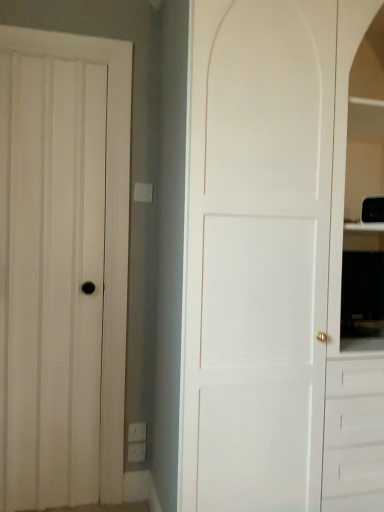
Locate an element on the screen. white matte door at left, the 2th door from the right is located at coordinates (105, 228).

The image size is (384, 512). Describe the element at coordinates (105, 228) in the screenshot. I see `white matte door at left, arranged as the first door when viewed from the left` at that location.

This screenshot has width=384, height=512. I want to click on white matte door at right, the first door positioned from the right, so click(257, 253).

The width and height of the screenshot is (384, 512). Describe the element at coordinates (257, 253) in the screenshot. I see `white matte door at right, the second door when ordered from left to right` at that location.

This screenshot has width=384, height=512. In order to click on white matte door at left, arranged as the first door when viewed from the left in this screenshot , I will do `click(105, 228)`.

Can you confirm if white matte door at left, the 2th door from the right, is positioned to the left of white matte door at right, the first door positioned from the right?

Yes.

Which object is more forward, white matte door at left, arranged as the first door when viewed from the left, or white matte door at right, the first door positioned from the right?

white matte door at right, the first door positioned from the right, is in front.

Which is farther, [123,51] or [234,189]?

Positioned behind is point [123,51].

From the image's perspective, is white matte door at left, arranged as the first door when viewed from the left, below white matte door at right, the first door positioned from the right?

Yes, from the image's perspective, white matte door at left, arranged as the first door when viewed from the left, is below white matte door at right, the first door positioned from the right.

From a real-world perspective, who is located higher, white matte door at left, the 2th door from the right, or white matte door at right, the first door positioned from the right?

white matte door at right, the first door positioned from the right.

Between white matte door at left, the 2th door from the right, and white matte door at right, the first door positioned from the right, which one has larger width?

white matte door at right, the first door positioned from the right, is wider.

Can you confirm if white matte door at left, arranged as the first door when viewed from the left, is taller than white matte door at right, the second door when ordered from left to right?

No.

Can you confirm if white matte door at left, the 2th door from the right, is bigger than white matte door at right, the second door when ordered from left to right?

No, white matte door at left, the 2th door from the right, is not bigger than white matte door at right, the second door when ordered from left to right.

Would you say white matte door at left, arranged as the first door when viewed from the left, is outside white matte door at right, the second door when ordered from left to right?

That's correct, white matte door at left, arranged as the first door when viewed from the left, is outside of white matte door at right, the second door when ordered from left to right.

Are white matte door at left, arranged as the first door when viewed from the left, and white matte door at right, the second door when ordered from left to right, far apart?

No, white matte door at left, arranged as the first door when viewed from the left, is not far from white matte door at right, the second door when ordered from left to right.

Is white matte door at left, arranged as the first door when viewed from the left, oriented away from white matte door at right, the second door when ordered from left to right?

white matte door at left, arranged as the first door when viewed from the left, does not have its back to white matte door at right, the second door when ordered from left to right.

This screenshot has height=512, width=384. In order to click on door above the white matte door at left, arranged as the first door when viewed from the left (from the image's perspective) in this screenshot , I will do `click(257, 253)`.

Considering the positions of objects white matte door at right, the second door when ordered from left to right, and white matte door at left, arranged as the first door when viewed from the left, in the image provided, who is more to the right, white matte door at right, the second door when ordered from left to right, or white matte door at left, arranged as the first door when viewed from the left,?

Positioned to the right is white matte door at right, the second door when ordered from left to right.

Between white matte door at right, the second door when ordered from left to right, and white matte door at left, arranged as the first door when viewed from the left, which one is positioned in front?

white matte door at right, the second door when ordered from left to right, is more forward.

Which point is more distant from viewer, (274, 106) or (32, 38)?

The point (32, 38) is farther from the camera.

From the image's perspective, which is below, white matte door at right, the second door when ordered from left to right, or white matte door at left, arranged as the first door when viewed from the left?

white matte door at left, arranged as the first door when viewed from the left, from the image's perspective.

Looking at this image, from a real-world perspective, is white matte door at right, the first door positioned from the right, physically above white matte door at left, the 2th door from the right?

Correct, in the physical world, white matte door at right, the first door positioned from the right, is higher than white matte door at left, the 2th door from the right.

From the picture: Considering the relative sizes of white matte door at right, the first door positioned from the right, and white matte door at left, arranged as the first door when viewed from the left, in the image provided, is white matte door at right, the first door positioned from the right, wider than white matte door at left, arranged as the first door when viewed from the left,?

Yes, white matte door at right, the first door positioned from the right, is wider than white matte door at left, arranged as the first door when viewed from the left.

Considering the sizes of objects white matte door at right, the second door when ordered from left to right, and white matte door at left, arranged as the first door when viewed from the left, in the image provided, who is taller, white matte door at right, the second door when ordered from left to right, or white matte door at left, arranged as the first door when viewed from the left,?

With more height is white matte door at right, the second door when ordered from left to right.

Is white matte door at right, the first door positioned from the right, smaller than white matte door at left, arranged as the first door when viewed from the left?

Incorrect, white matte door at right, the first door positioned from the right, is not smaller in size than white matte door at left, arranged as the first door when viewed from the left.

Is white matte door at right, the first door positioned from the right, not inside white matte door at left, the 2th door from the right?

white matte door at right, the first door positioned from the right, lies outside white matte door at left, the 2th door from the right,'s area.

Is white matte door at right, the second door when ordered from left to right, far away from white matte door at left, arranged as the first door when viewed from the left?

That's not correct — white matte door at right, the second door when ordered from left to right, is a little close to white matte door at left, arranged as the first door when viewed from the left.

Is white matte door at right, the second door when ordered from left to right, turned away from white matte door at left, the 2th door from the right?

No.

How different are the orientations of white matte door at right, the second door when ordered from left to right, and white matte door at left, arranged as the first door when viewed from the left, in degrees?

There is a 0.00278-degree angle between the facing directions of white matte door at right, the second door when ordered from left to right, and white matte door at left, arranged as the first door when viewed from the left.

How distant is white matte door at right, the first door positioned from the right, from white matte door at left, arranged as the first door when viewed from the left?

29.52 inches.

Find the location of `door located below the white matte door at right, the second door when ordered from left to right (from the image's perspective)`. door located below the white matte door at right, the second door when ordered from left to right (from the image's perspective) is located at coordinates (105, 228).

Identify the location of door that appears on the right of white matte door at left, the 2th door from the right. This screenshot has width=384, height=512. (257, 253).

Where is `door below the white matte door at right, the first door positioned from the right (from the image's perspective)`? The height and width of the screenshot is (512, 384). door below the white matte door at right, the first door positioned from the right (from the image's perspective) is located at coordinates (105, 228).